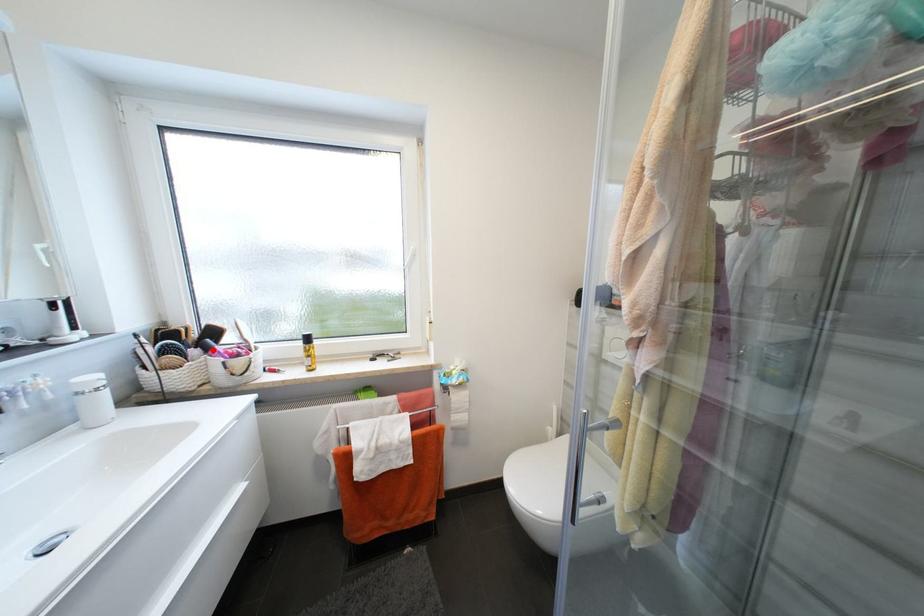
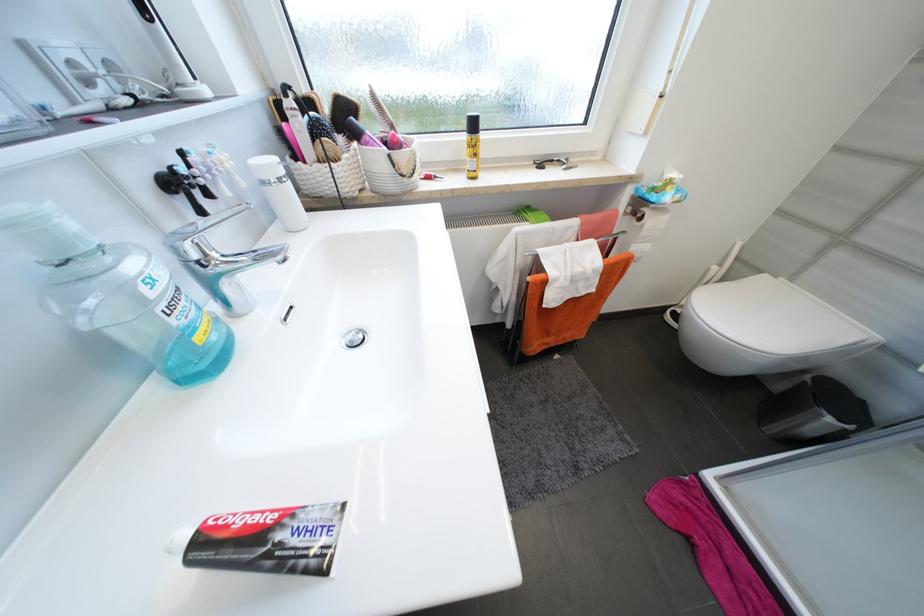
In the second image, find the point that corresponds to the highlighted location in the first image.

(362, 136)